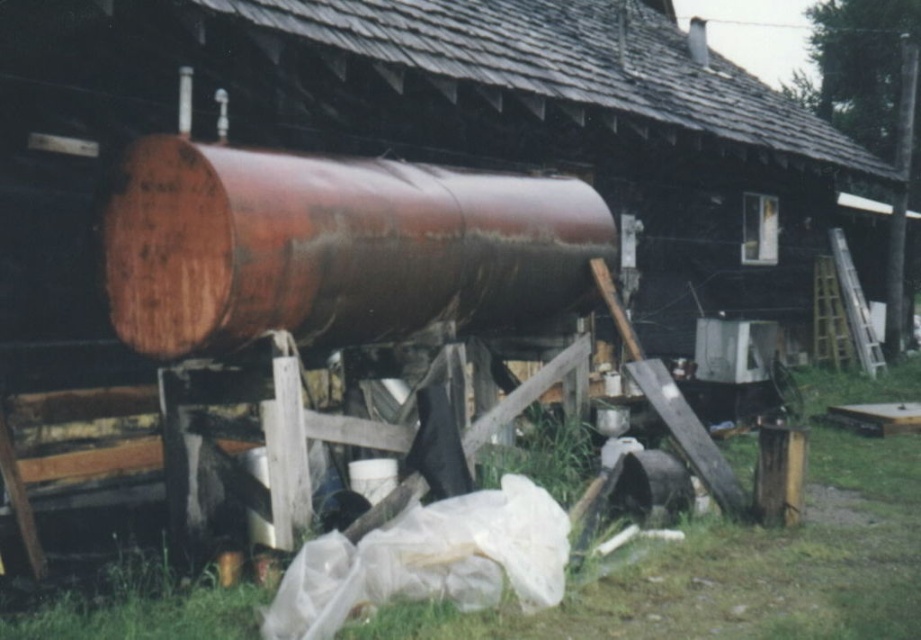
Question: Can you confirm if rusty metal barrel at center is positioned to the left of green grass at lower center?

Choices:
 (A) yes
 (B) no

Answer: (A)

Question: Where is rusty metal barrel at center located in relation to green grass at lower center in the image?

Choices:
 (A) below
 (B) above

Answer: (B)

Question: Which of the following is the closest to the observer?

Choices:
 (A) (288, 166)
 (B) (633, 627)

Answer: (B)

Question: Is rusty metal barrel at center further to the viewer compared to green grass at lower center?

Choices:
 (A) no
 (B) yes

Answer: (B)